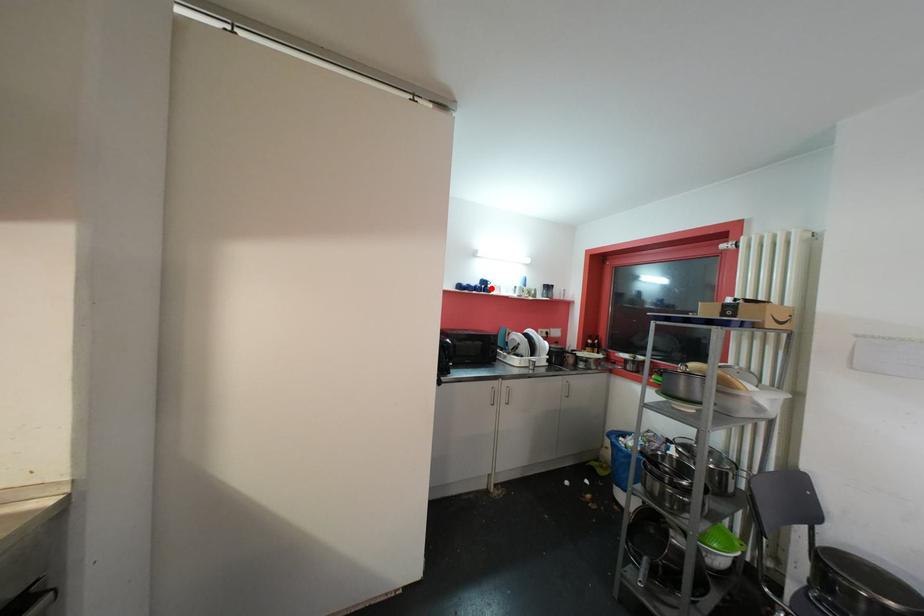
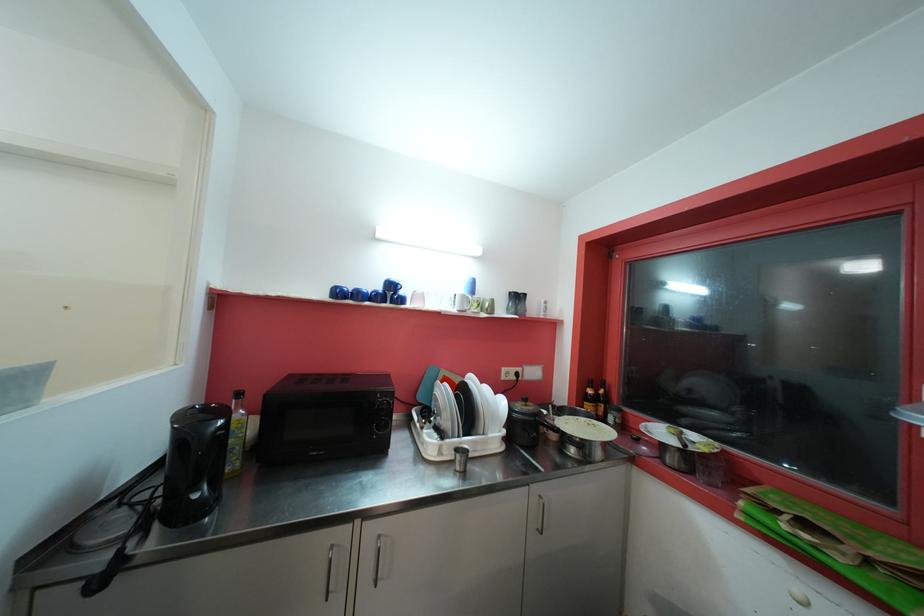
Where in the second image is the point corresponding to the highlighted location from the first image?

(399, 294)